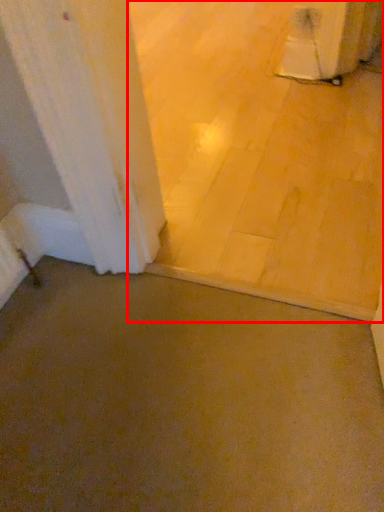
Question: Where is concrete (annotated by the red box) located in relation to concrete in the image?

Choices:
 (A) left
 (B) right

Answer: (B)